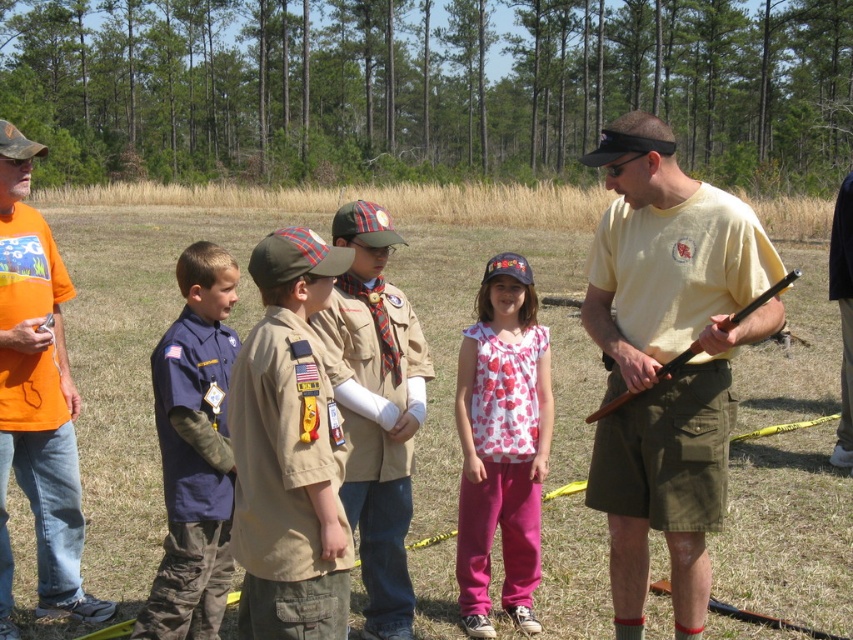
Question: Estimate the real-world distances between objects in this image. Which object is closer to the navy blue uniform at center?

Choices:
 (A) khaki uniform at center
 (B) white heart-patterned blouse at center
 (C) orange cotton t-shirt at left

Answer: (C)

Question: Which point is closer to the camera?

Choices:
 (A) (718, 365)
 (B) (347, 593)
 (C) (618, 403)

Answer: (B)

Question: Estimate the real-world distances between objects in this image. Which object is farther from the orange cotton t-shirt at left?

Choices:
 (A) wooden shotgun at right
 (B) yellow cotton shirt at right
 (C) navy blue uniform at center
 (D) white heart-patterned blouse at center

Answer: (A)

Question: Is khaki uniform at center to the right of navy blue uniform at center from the viewer's perspective?

Choices:
 (A) no
 (B) yes

Answer: (B)

Question: Is yellow cotton shirt at right smaller than orange cotton t-shirt at left?

Choices:
 (A) no
 (B) yes

Answer: (A)

Question: Does yellow cotton shirt at right appear on the right side of white heart-patterned blouse at center?

Choices:
 (A) yes
 (B) no

Answer: (A)